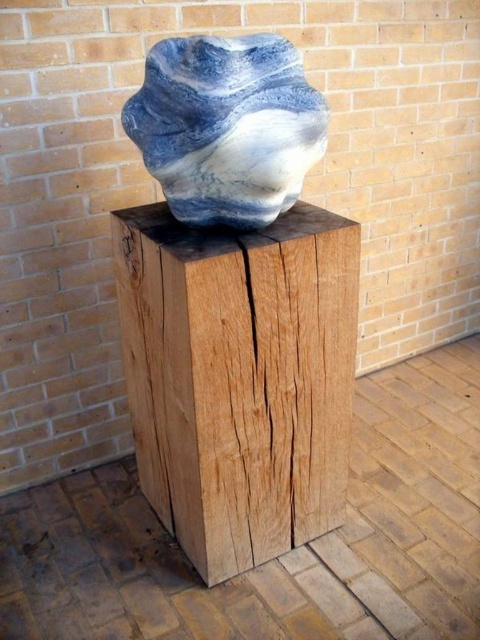
Question: Can you confirm if natural wood block at center is positioned above marble-like stone at center?

Choices:
 (A) yes
 (B) no

Answer: (B)

Question: Which of the following is the farthest from the observer?

Choices:
 (A) natural wood block at center
 (B) marble-like stone at center

Answer: (A)

Question: Which point is farther from the camera taking this photo?

Choices:
 (A) (320, 99)
 (B) (247, 346)

Answer: (B)

Question: From the image, what is the correct spatial relationship of natural wood block at center in relation to marble-like stone at center?

Choices:
 (A) above
 (B) below

Answer: (B)

Question: Does natural wood block at center lie behind marble-like stone at center?

Choices:
 (A) no
 (B) yes

Answer: (B)

Question: Which point appears closest to the camera in this image?

Choices:
 (A) [142, 269]
 (B) [273, 40]

Answer: (B)